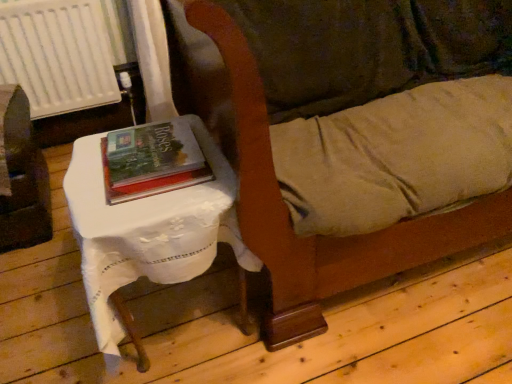
Where is `free region on the left part of white cloth-covered table at left`? This screenshot has width=512, height=384. free region on the left part of white cloth-covered table at left is located at coordinates (50, 320).